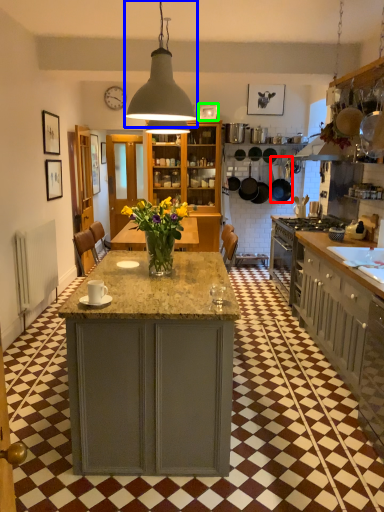
Question: Considering the real-world distances, which object is farthest from frying pan (highlighted by a red box)? light fixture (highlighted by a blue box) or picture frame (highlighted by a green box)?

Choices:
 (A) light fixture
 (B) picture frame

Answer: (A)